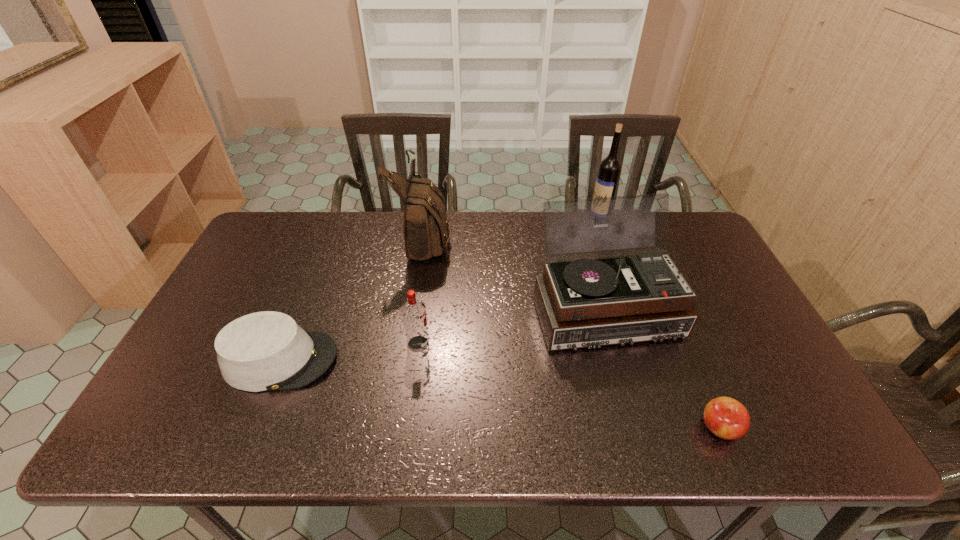
You are a GUI agent. You are given a task and a screenshot of the screen. Output one action in this format:
    pyautogui.click(x=<x>, y=<y>)
    Task: Click on the wine bottle
    This screenshot has height=540, width=960.
    Given the screenshot: What is the action you would take?
    pyautogui.click(x=610, y=167)

Where is `shoulder bag`? This screenshot has width=960, height=540. shoulder bag is located at coordinates (425, 230).

Locate an element on the screen. The width and height of the screenshot is (960, 540). record player is located at coordinates (588, 302).

At what (x,y) coordinates should I click in order to perform the action: click on vodka. Please return your answer as a coordinate pair (x, y). Looking at the image, I should click on (413, 311).

Identify the location of the leftmost object. (264, 351).

The width and height of the screenshot is (960, 540). I want to click on the second shortest object, so click(x=264, y=351).

Find the location of `the shortest object`. the shortest object is located at coordinates (725, 417).

The width and height of the screenshot is (960, 540). I want to click on apple, so click(x=725, y=417).

Find the location of a particular element. The width and height of the screenshot is (960, 540). free spot located 0.290m on the label of the wine bottle is located at coordinates pos(507,221).

At what (x,y) coordinates should I click in order to perform the action: click on vacant area located 0.290m on the label of the wine bottle. Please return your answer as a coordinate pair (x, y). Looking at the image, I should click on (507, 221).